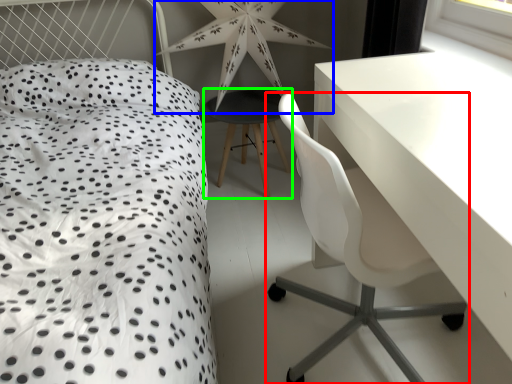
Question: Estimate the real-world distances between objects in this image. Which object is closer to chair (highlighted by a red box), star (highlighted by a blue box) or bar stool (highlighted by a green box)?

Choices:
 (A) star
 (B) bar stool

Answer: (B)